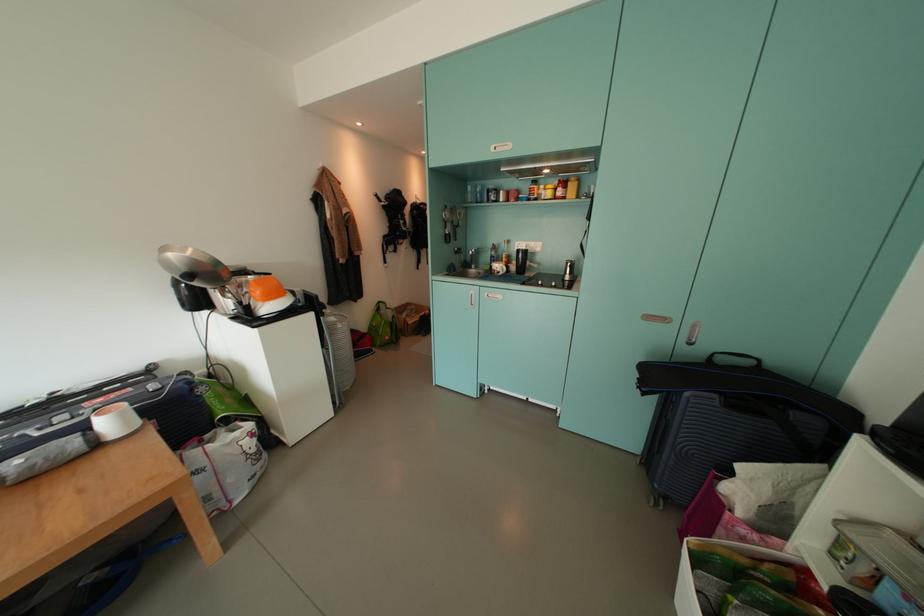
This screenshot has height=616, width=924. I want to click on yellow bottle, so pos(572,188).